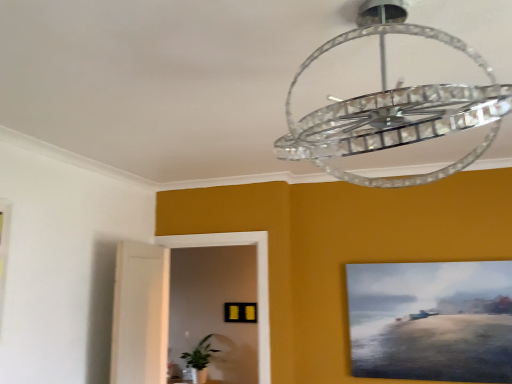
Question: Is clear crystal chandelier at upper center taller than green leafy plant at lower left?

Choices:
 (A) yes
 (B) no

Answer: (A)

Question: Is clear crystal chandelier at upper center oriented away from green leafy plant at lower left?

Choices:
 (A) yes
 (B) no

Answer: (B)

Question: Is clear crystal chandelier at upper center positioned behind green leafy plant at lower left?

Choices:
 (A) no
 (B) yes

Answer: (A)

Question: From a real-world perspective, is clear crystal chandelier at upper center beneath green leafy plant at lower left?

Choices:
 (A) no
 (B) yes

Answer: (A)

Question: Does clear crystal chandelier at upper center turn towards green leafy plant at lower left?

Choices:
 (A) no
 (B) yes

Answer: (A)

Question: In the image, is clear crystal chandelier at upper center positioned in front of or behind matte canvas painting at right, which is the second picture frame from left to right?

Choices:
 (A) front
 (B) behind

Answer: (A)

Question: Is clear crystal chandelier at upper center bigger or smaller than matte canvas painting at right, arranged as the second picture frame when ordered from the bottom?

Choices:
 (A) small
 (B) big

Answer: (B)

Question: From the image's perspective, is clear crystal chandelier at upper center positioned above or below matte canvas painting at right, placed as the first picture frame when sorted from right to left?

Choices:
 (A) below
 (B) above

Answer: (B)

Question: Based on their positions, is clear crystal chandelier at upper center located to the left or right of matte canvas painting at right, which is the first picture frame from front to back?

Choices:
 (A) right
 (B) left

Answer: (B)

Question: Is matte yellow picture frame at center, acting as the 2th picture frame starting from the front, wider or thinner than green leafy plant at lower left?

Choices:
 (A) wide
 (B) thin

Answer: (B)

Question: Is point (227, 312) closer or farther from the camera than point (210, 349)?

Choices:
 (A) closer
 (B) farther

Answer: (A)

Question: From the image's perspective, relative to green leafy plant at lower left, is matte yellow picture frame at center, acting as the 2th picture frame starting from the front, above or below?

Choices:
 (A) above
 (B) below

Answer: (A)

Question: In terms of height, does matte yellow picture frame at center, the 1th picture frame positioned from the left, look taller or shorter compared to green leafy plant at lower left?

Choices:
 (A) tall
 (B) short

Answer: (B)

Question: Is clear crystal chandelier at upper center in front of or behind green leafy plant at lower left in the image?

Choices:
 (A) front
 (B) behind

Answer: (A)

Question: Considering the positions of clear crystal chandelier at upper center and green leafy plant at lower left in the image, is clear crystal chandelier at upper center wider or thinner than green leafy plant at lower left?

Choices:
 (A) wide
 (B) thin

Answer: (A)